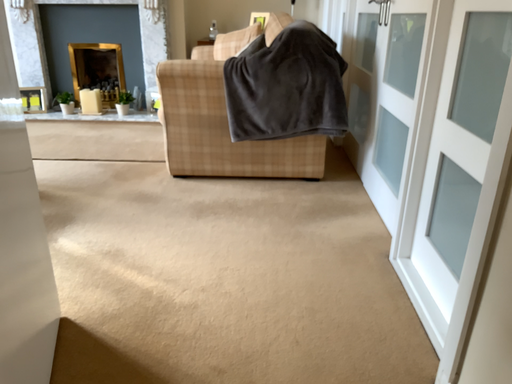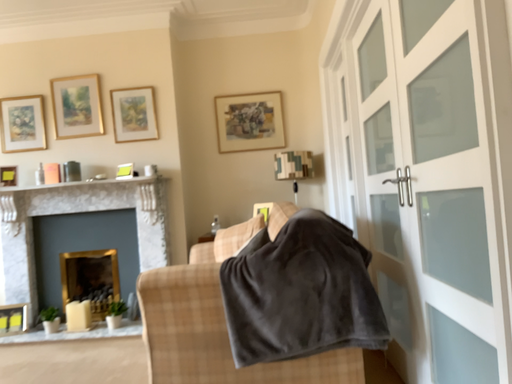
Question: How did the camera likely rotate when shooting the video?

Choices:
 (A) rotated downward
 (B) rotated upward

Answer: (B)